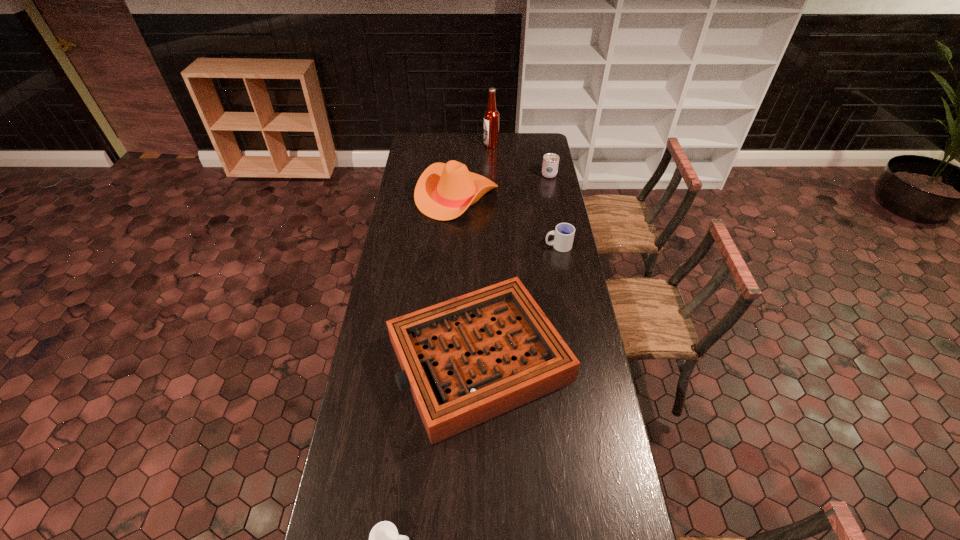
The width and height of the screenshot is (960, 540). Find the location of `the farthest object`. the farthest object is located at coordinates click(491, 116).

Find the location of `the tallest object`. the tallest object is located at coordinates (491, 116).

Where is `cowboy hat`? cowboy hat is located at coordinates (443, 192).

In order to click on the third tallest object in this screenshot , I will do `click(550, 160)`.

Identify the location of the farthest cup. The image size is (960, 540). (550, 160).

You are a GUI agent. You are given a task and a screenshot of the screen. Output one action in this format:
    pyautogui.click(x=<x>, y=<y>)
    Task: Click on the gameboard
    The image size is (960, 540).
    Given the screenshot: What is the action you would take?
    pyautogui.click(x=466, y=360)

Identify the location of the second tallest cup. The width and height of the screenshot is (960, 540). (563, 234).

You are a GUI agent. You are given a task and a screenshot of the screen. Output one action in this format:
    pyautogui.click(x=<x>, y=<y>)
    Task: Click on the third nearest object
    
    Given the screenshot: What is the action you would take?
    pyautogui.click(x=563, y=234)

Locate an element on the screen. free space located on the label side of the alcohol is located at coordinates (450, 145).

The image size is (960, 540). I want to click on vacant space situated on the label side of the alcohol, so click(450, 145).